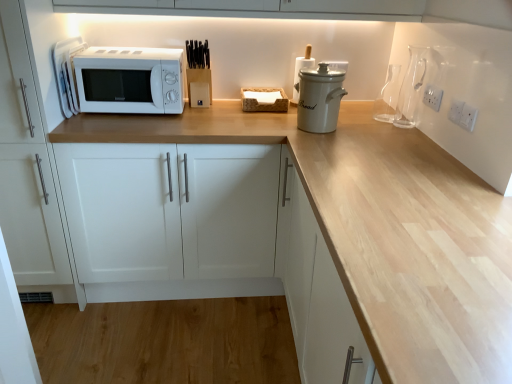
Question: Can you confirm if transparent glass carafe at upper right, the 1th appliance viewed from the right, is taller than transparent glass carafe at upper right?

Choices:
 (A) yes
 (B) no

Answer: (A)

Question: Is transparent glass carafe at upper right, the 1th appliance viewed from the right, oriented towards transparent glass carafe at upper right?

Choices:
 (A) yes
 (B) no

Answer: (B)

Question: From a real-world perspective, is transparent glass carafe at upper right, the 1th appliance viewed from the right, below transparent glass carafe at upper right?

Choices:
 (A) no
 (B) yes

Answer: (A)

Question: Is transparent glass carafe at upper right, the 1th appliance viewed from the right, positioned before transparent glass carafe at upper right?

Choices:
 (A) yes
 (B) no

Answer: (A)

Question: From a real-world perspective, is transparent glass carafe at upper right, the 1th appliance viewed from the right, located higher than transparent glass carafe at upper right?

Choices:
 (A) no
 (B) yes

Answer: (B)

Question: Considering the relative sizes of transparent glass carafe at upper right, arranged as the 4th appliance when viewed from the left, and transparent glass carafe at upper right in the image provided, is transparent glass carafe at upper right, arranged as the 4th appliance when viewed from the left, smaller than transparent glass carafe at upper right?

Choices:
 (A) no
 (B) yes

Answer: (A)

Question: Does white ceramic crock at center, acting as the second appliance starting from the right, have a lesser width compared to white plastic electric outlet at upper right, which is counted as the 1th electric outlet, starting from the bottom?

Choices:
 (A) no
 (B) yes

Answer: (A)

Question: Can you confirm if white ceramic crock at center, acting as the second appliance starting from the right, is shorter than white plastic electric outlet at upper right, the second electric outlet in the top-to-bottom sequence?

Choices:
 (A) yes
 (B) no

Answer: (B)

Question: Could you tell me if white ceramic crock at center, the third appliance in the left-to-right sequence, is turned towards white plastic electric outlet at upper right, which is the first electric outlet in front-to-back order?

Choices:
 (A) yes
 (B) no

Answer: (B)

Question: Does white ceramic crock at center, the third appliance in the left-to-right sequence, have a greater width compared to white plastic electric outlet at upper right, the second electric outlet in the top-to-bottom sequence?

Choices:
 (A) yes
 (B) no

Answer: (A)

Question: Is white ceramic crock at center, the third appliance in the left-to-right sequence, positioned behind white plastic electric outlet at upper right, the second electric outlet in the top-to-bottom sequence?

Choices:
 (A) yes
 (B) no

Answer: (A)

Question: From the image's perspective, is white ceramic crock at center, the third appliance in the left-to-right sequence, on white plastic electric outlet at upper right, the second electric outlet in the top-to-bottom sequence?

Choices:
 (A) no
 (B) yes

Answer: (B)

Question: Is transparent glass carafe at upper right inside white ceramic crock at center, the third appliance in the left-to-right sequence?

Choices:
 (A) no
 (B) yes

Answer: (A)